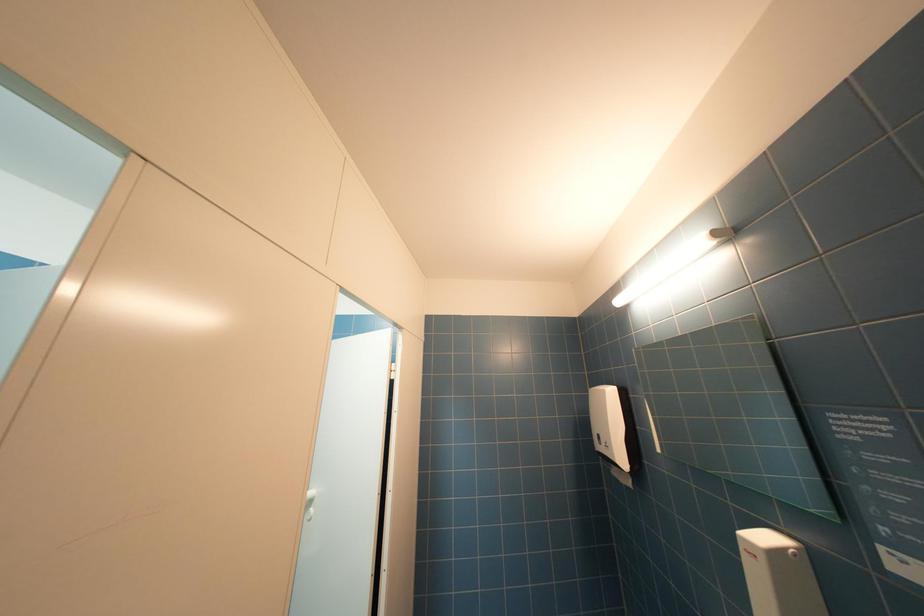
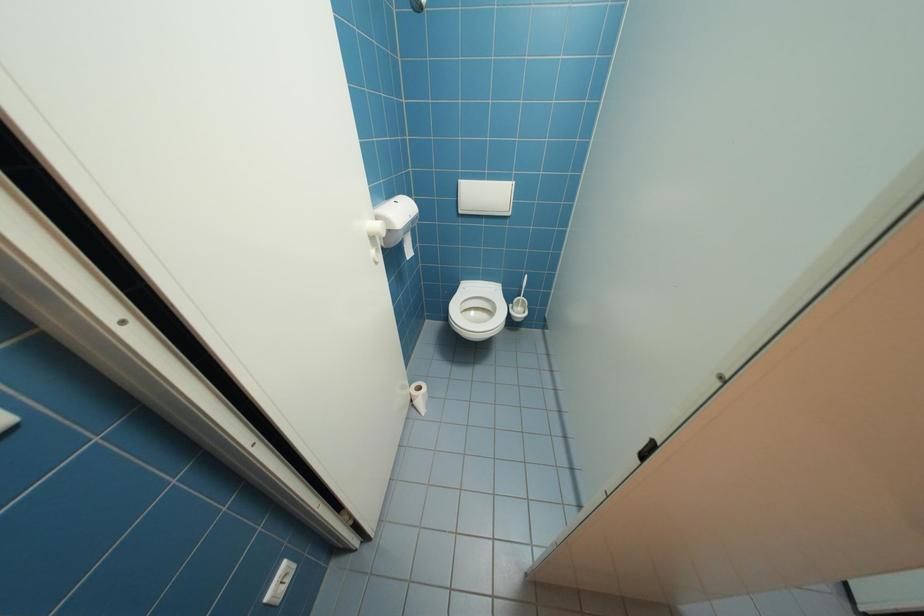
The images are taken continuously from a first-person perspective. In which direction is your viewpoint rotating?

The rotation direction of the camera is left-down.